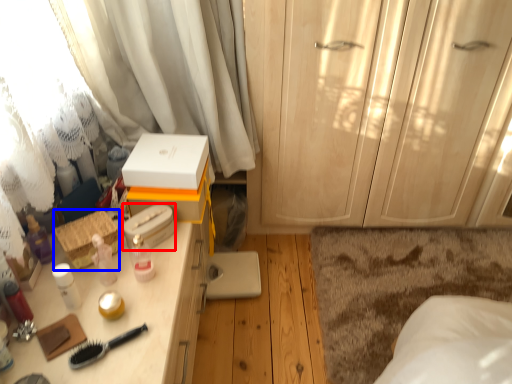
Question: Which of the following is the farthest to the observer, storage box (highlighted by a red box) or storage box (highlighted by a blue box)?

Choices:
 (A) storage box
 (B) storage box

Answer: (A)